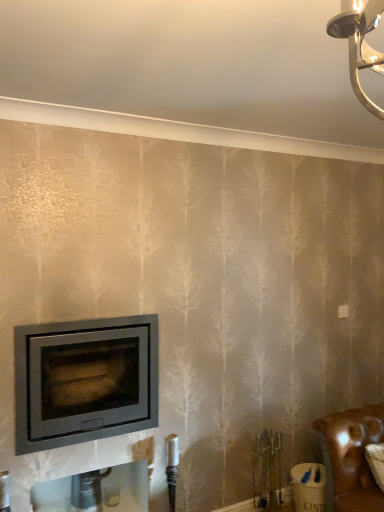
Question: Does brown leather couch at lower right have a greater height compared to matte gray wood burning stove at lower left?

Choices:
 (A) yes
 (B) no

Answer: (B)

Question: Considering the relative sizes of brown leather couch at lower right and matte gray wood burning stove at lower left in the image provided, is brown leather couch at lower right shorter than matte gray wood burning stove at lower left?

Choices:
 (A) no
 (B) yes

Answer: (B)

Question: Does brown leather couch at lower right have a larger size compared to matte gray wood burning stove at lower left?

Choices:
 (A) yes
 (B) no

Answer: (B)

Question: Does brown leather couch at lower right lie behind matte gray wood burning stove at lower left?

Choices:
 (A) yes
 (B) no

Answer: (A)

Question: Can you confirm if brown leather couch at lower right is thinner than matte gray wood burning stove at lower left?

Choices:
 (A) yes
 (B) no

Answer: (A)

Question: Is brown leather couch at lower right positioned in front of matte gray wood burning stove at lower left?

Choices:
 (A) no
 (B) yes

Answer: (A)

Question: Does matte gray wood burning stove at lower left turn towards brown leather couch at lower right?

Choices:
 (A) yes
 (B) no

Answer: (B)

Question: Is matte gray wood burning stove at lower left located outside brown leather couch at lower right?

Choices:
 (A) no
 (B) yes

Answer: (B)

Question: Is matte gray wood burning stove at lower left in contact with brown leather couch at lower right?

Choices:
 (A) no
 (B) yes

Answer: (A)

Question: Does matte gray wood burning stove at lower left have a larger size compared to brown leather couch at lower right?

Choices:
 (A) yes
 (B) no

Answer: (A)

Question: Can you confirm if matte gray wood burning stove at lower left is taller than brown leather couch at lower right?

Choices:
 (A) yes
 (B) no

Answer: (A)

Question: Is matte gray wood burning stove at lower left shorter than brown leather couch at lower right?

Choices:
 (A) yes
 (B) no

Answer: (B)

Question: Is brown leather couch at lower right situated inside matte gray wood burning stove at lower left or outside?

Choices:
 (A) outside
 (B) inside

Answer: (A)